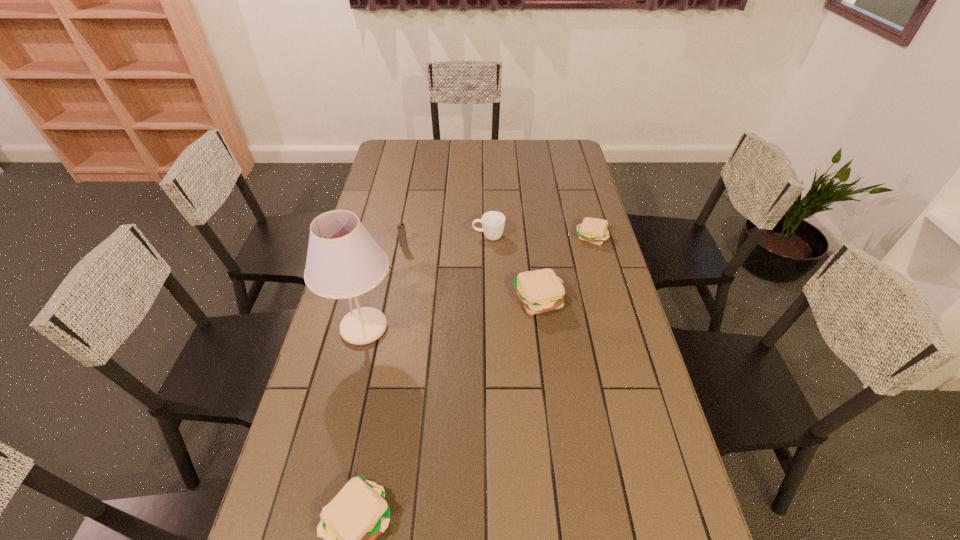
The width and height of the screenshot is (960, 540). Find the location of `vacant space situated 0.210m with the handle on the side of the cup`. vacant space situated 0.210m with the handle on the side of the cup is located at coordinates (416, 237).

The width and height of the screenshot is (960, 540). Identify the location of vacant space situated with the handle on the side of the cup. (383, 237).

At what (x,y) coordinates should I click in order to perform the action: click on vacant space located on the right of the igniter. Please return your answer as a coordinate pair (x, y). The width and height of the screenshot is (960, 540). Looking at the image, I should click on (427, 246).

I want to click on vacant space located on the front of the tallest object, so click(333, 461).

Find the location of a particular element. The height and width of the screenshot is (540, 960). object located in the left edge section of the desktop is located at coordinates (343, 261).

The image size is (960, 540). In order to click on object at the right edge in this screenshot , I will do `click(592, 230)`.

Image resolution: width=960 pixels, height=540 pixels. In order to click on vacant area at the far edge in this screenshot , I will do `click(491, 141)`.

Image resolution: width=960 pixels, height=540 pixels. Find the location of `vacant space at the near edge of the desktop`. vacant space at the near edge of the desktop is located at coordinates (518, 516).

Locate an element on the screen. This screenshot has height=540, width=960. vacant point at the left edge is located at coordinates (332, 426).

Locate an element on the screen. vacant space at the right edge of the desktop is located at coordinates (595, 301).